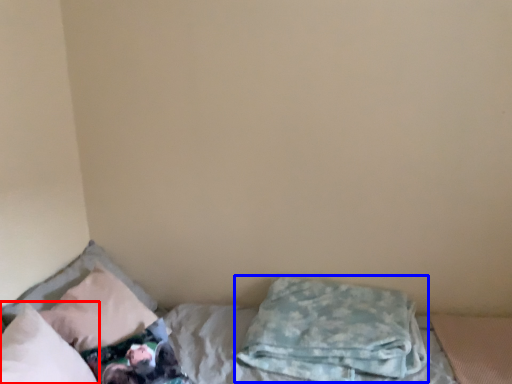
Question: Among these objects, which one is farthest to the camera, pillow (highlighted by a red box) or pillow (highlighted by a blue box)?

Choices:
 (A) pillow
 (B) pillow

Answer: (B)